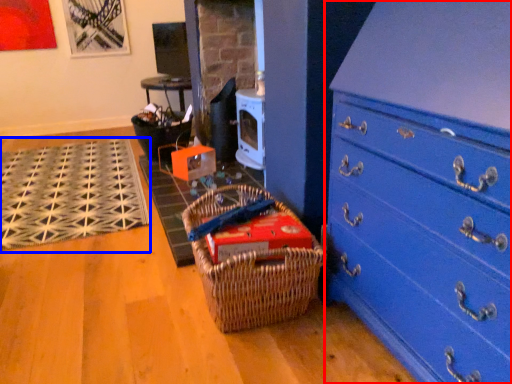
Question: Which object appears farthest to the camera in this image, chest of drawers (highlighted by a red box) or doormat (highlighted by a blue box)?

Choices:
 (A) chest of drawers
 (B) doormat

Answer: (B)